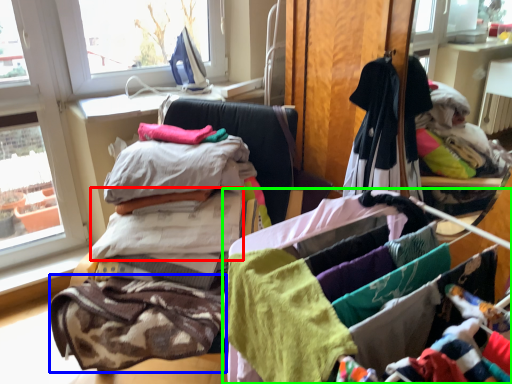
Question: Based on their relative distances, which object is nearer to baby clothe (highlighted by a red box)? Choose from baby clothe (highlighted by a blue box) and material (highlighted by a green box).

Choices:
 (A) baby clothe
 (B) material

Answer: (A)